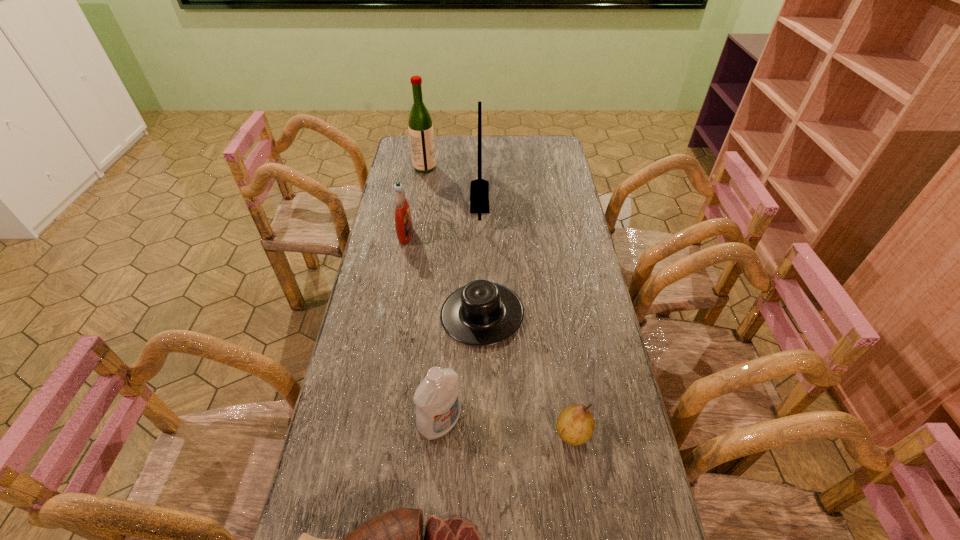
Locate an element on the screen. vacant space located 0.370m on the front surface of the left detergent is located at coordinates (512, 234).

Where is `free location located on the left of the rightmost object`? free location located on the left of the rightmost object is located at coordinates (471, 432).

You are a GUI agent. You are given a task and a screenshot of the screen. Output one action in this format:
    pyautogui.click(x=<x>, y=<y>)
    Task: Click on the vacant region located 0.390m on the back of the dress hat
    
    Given the screenshot: What is the action you would take?
    pyautogui.click(x=482, y=212)

Image resolution: width=960 pixels, height=540 pixels. Identify the location of object present at the far edge. (421, 134).

Image resolution: width=960 pixels, height=540 pixels. In order to click on liquor at the left edge in this screenshot , I will do `click(421, 134)`.

Identify the location of detergent situated at the left edge. (403, 220).

Where is `object at the right edge`? The image size is (960, 540). object at the right edge is located at coordinates (575, 425).

Find the location of a particular element. object that is at the far left corner is located at coordinates (421, 134).

You are a GUI agent. You are given a task and a screenshot of the screen. Output one action in this format:
    pyautogui.click(x=<x>, y=<y>)
    Task: Click on the vacant space at the far edge of the desktop
    
    Given the screenshot: What is the action you would take?
    pyautogui.click(x=471, y=136)

The image size is (960, 540). I want to click on free region at the left edge of the desktop, so click(386, 404).